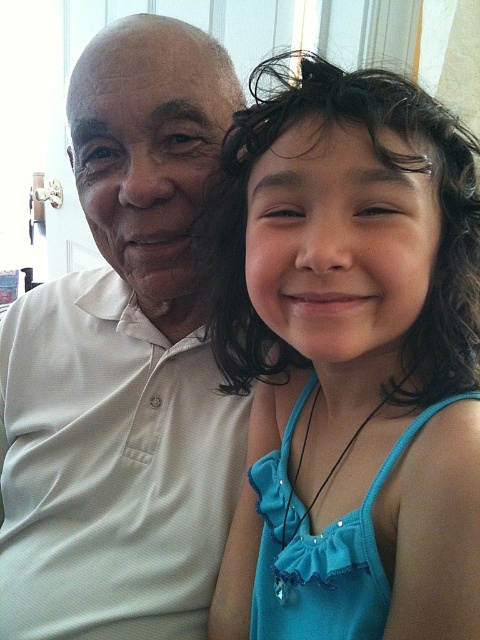
Question: Can you confirm if blue satin dress at right is positioned to the left of white matte shirt at left?

Choices:
 (A) yes
 (B) no

Answer: (B)

Question: Which point is farther to the camera?

Choices:
 (A) (336, 282)
 (B) (110, 65)

Answer: (B)

Question: Does blue satin dress at right appear under white matte shirt at left?

Choices:
 (A) yes
 (B) no

Answer: (A)

Question: Does blue satin dress at right come in front of white matte shirt at left?

Choices:
 (A) no
 (B) yes

Answer: (B)

Question: Which point is farther from the camera taking this photo?

Choices:
 (A) (164, 548)
 (B) (421, 136)

Answer: (A)